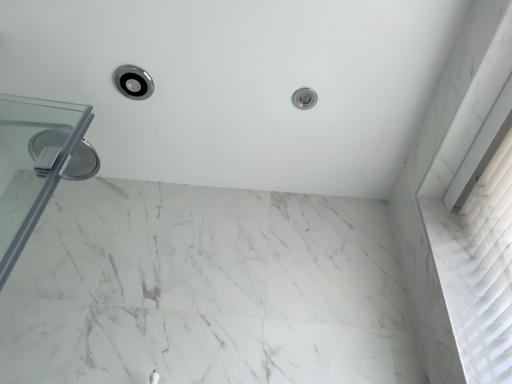
Question: Considering the positions of polished chrome showerhead at upper left, which is the first shower from left to right, and white marble bath at upper center in the image, is polished chrome showerhead at upper left, which is the first shower from left to right, wider or thinner than white marble bath at upper center?

Choices:
 (A) wide
 (B) thin

Answer: (B)

Question: From the image's perspective, relative to white marble bath at upper center, is polished chrome showerhead at upper left, which is the first shower from left to right, above or below?

Choices:
 (A) above
 (B) below

Answer: (A)

Question: Which object is positioned farthest from the satin nickel showerhead at upper center, the 1th shower positioned from the right?

Choices:
 (A) white marble bath at upper center
 (B) polished chrome showerhead at upper left, which is the first shower from left to right
 (C) transparent glass door at left

Answer: (C)

Question: Which is farther from the satin nickel showerhead at upper center, which appears as the 2th shower when viewed from the left?

Choices:
 (A) white marble bath at upper center
 (B) transparent glass door at left
 (C) polished chrome showerhead at upper left, the second shower when ordered from right to left

Answer: (B)